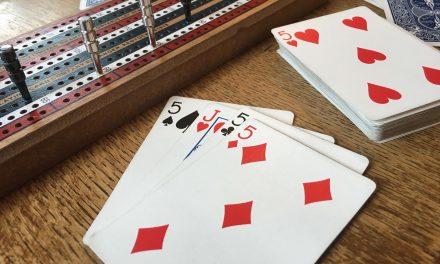
You are a GUI agent. You are given a task and a screenshot of the screen. Output one action in this format:
    pyautogui.click(x=<x>, y=<y>)
    Task: Click on the grain lines in table
    The image size is (440, 264).
    Given the screenshot: What is the action you would take?
    pyautogui.click(x=54, y=228)